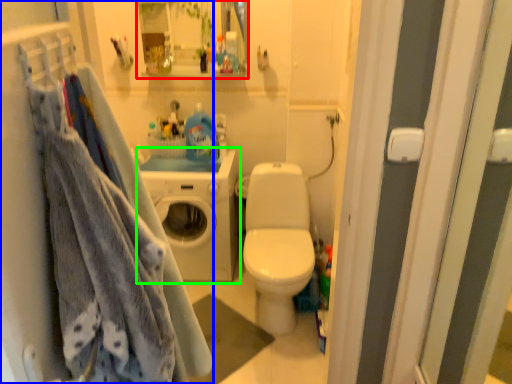
Question: Estimate the real-world distances between objects in this image. Which object is closer to cabinet (highlighted by a red box), closet (highlighted by a blue box) or washing machine (highlighted by a green box)?

Choices:
 (A) closet
 (B) washing machine

Answer: (B)